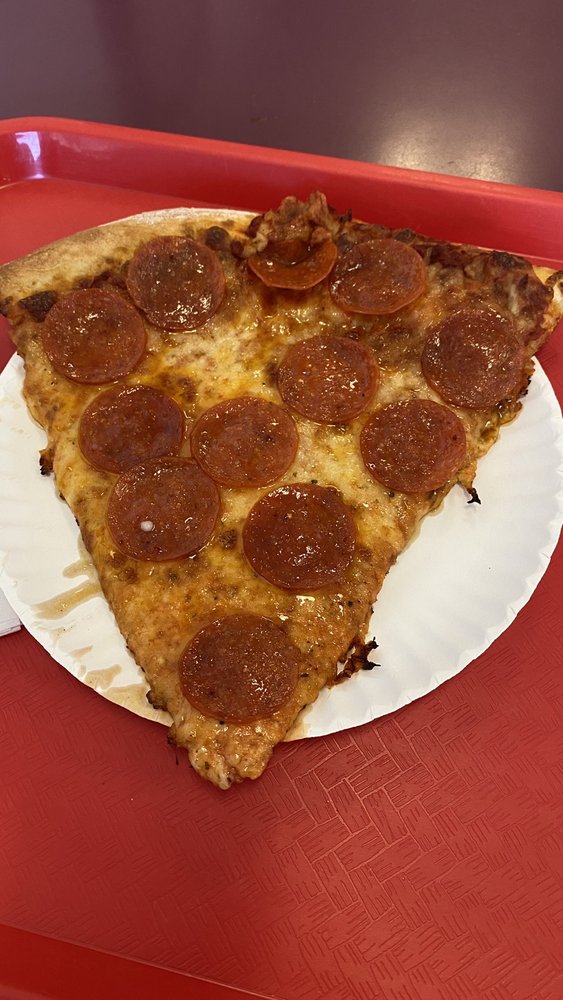
Image resolution: width=563 pixels, height=1000 pixels. I want to click on table, so click(x=459, y=77), click(x=138, y=48).